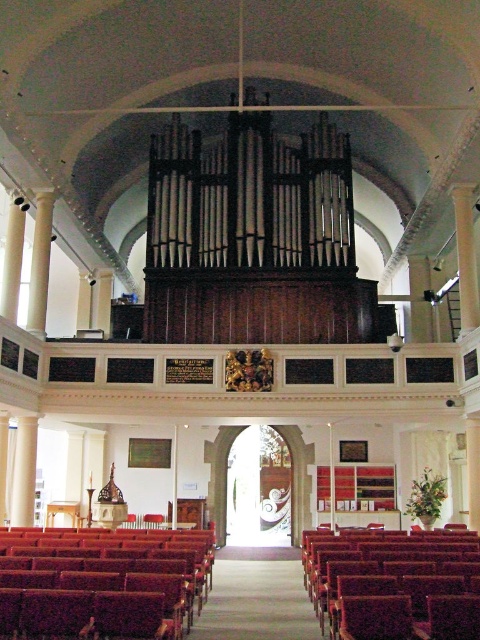
Question: Which of the following is the closest to the observer?

Choices:
 (A) (384, 582)
 (B) (99, 627)

Answer: (B)

Question: In this image, where is smooth wood bench at lower left located relative to velvet burgundy bench at lower right?

Choices:
 (A) below
 (B) above

Answer: (B)

Question: Does smooth wood bench at lower left appear over velvet burgundy bench at lower right?

Choices:
 (A) no
 (B) yes

Answer: (B)

Question: Where is smooth wood bench at lower left located in relation to velvet burgundy bench at lower right in the image?

Choices:
 (A) above
 (B) below

Answer: (A)